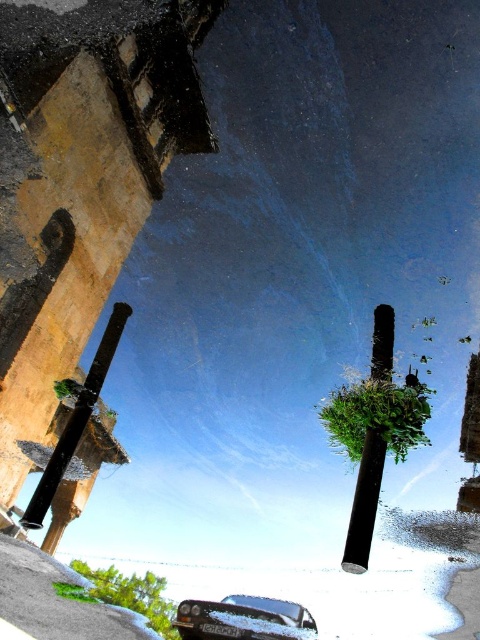
Question: Does black matte pole at center have a greater width compared to black glossy pole at left?

Choices:
 (A) no
 (B) yes

Answer: (A)

Question: Which of the following is the closest to the observer?

Choices:
 (A) metallic silver car at lower center
 (B) black glossy pole at left
 (C) black matte pole at center

Answer: (C)

Question: Is metallic silver car at lower center further to the viewer compared to black matte pole at center?

Choices:
 (A) yes
 (B) no

Answer: (A)

Question: Which object appears closest to the camera in this image?

Choices:
 (A) black matte pole at center
 (B) metallic silver car at lower center
 (C) black glossy pole at left

Answer: (A)

Question: Is black matte pole at center bigger than black glossy pole at left?

Choices:
 (A) yes
 (B) no

Answer: (B)

Question: Which object appears farthest from the camera in this image?

Choices:
 (A) black matte pole at center
 (B) metallic silver car at lower center
 (C) black glossy pole at left

Answer: (C)